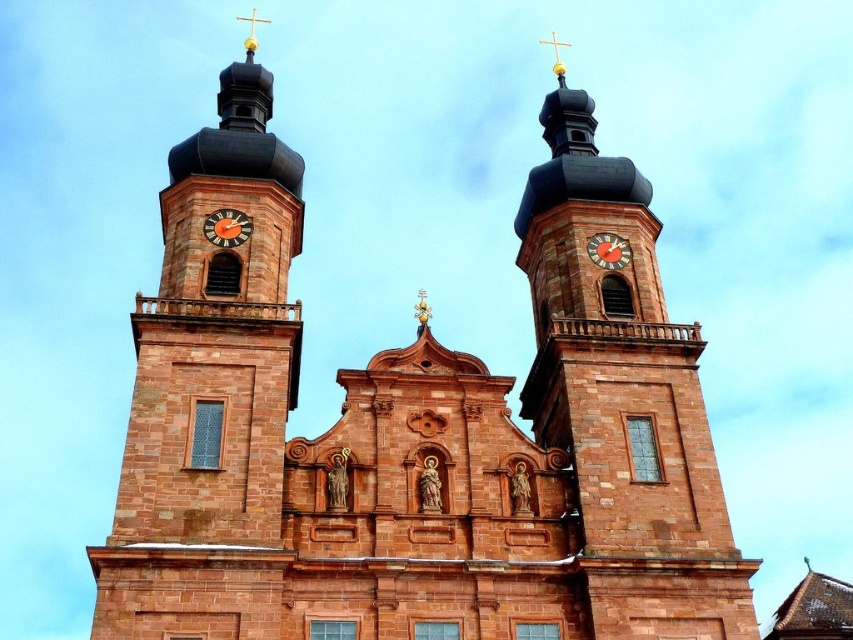
Question: Based on their relative distances, which object is farther from the brown stone tower at left?

Choices:
 (A) orange metallic clock at upper left
 (B) orange wooden clock at center
 (C) brown stone tower at center

Answer: (B)

Question: Does brown stone tower at left appear over orange metallic clock at upper left?

Choices:
 (A) no
 (B) yes

Answer: (B)

Question: Does brown stone tower at left appear over orange wooden clock at center?

Choices:
 (A) no
 (B) yes

Answer: (B)

Question: Which of these objects is positioned farthest from the orange metallic clock at upper left?

Choices:
 (A) brown stone tower at left
 (B) orange wooden clock at center
 (C) brown stone tower at center

Answer: (C)

Question: Is brown stone tower at left smaller than brown stone tower at center?

Choices:
 (A) yes
 (B) no

Answer: (B)

Question: Which of the following is the farthest from the observer?

Choices:
 (A) orange metallic clock at upper left
 (B) brown stone tower at left

Answer: (A)